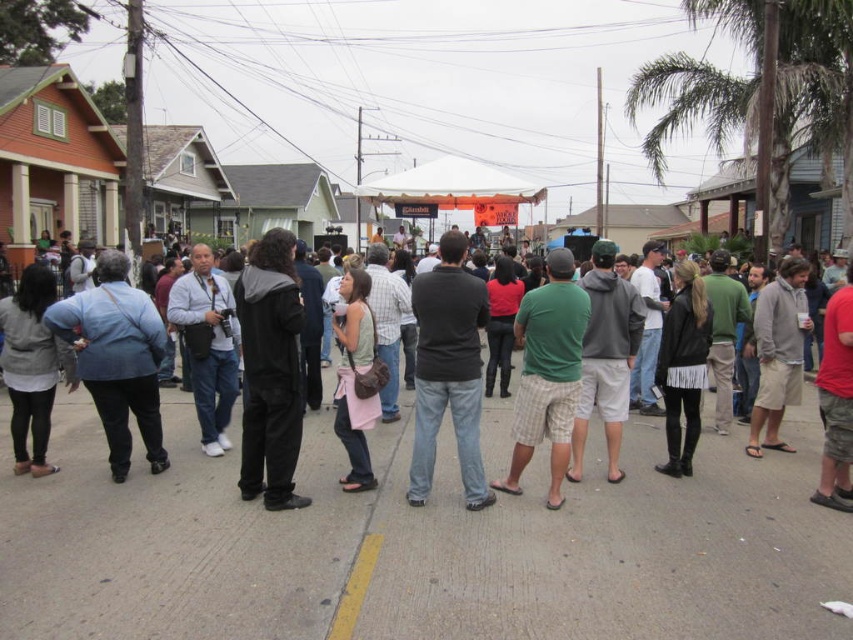
Between black matte jumpsuit at center and black matte shirt at center, which one appears on the right side from the viewer's perspective?

Positioned to the right is black matte shirt at center.

Consider the image. Who is lower down, black matte jumpsuit at center or black matte shirt at center?

black matte shirt at center is lower down.

What do you see at coordinates (270, 371) in the screenshot?
I see `black matte jumpsuit at center` at bounding box center [270, 371].

At what (x,y) coordinates should I click in order to perform the action: click on black matte jumpsuit at center. Please return your answer as a coordinate pair (x, y). The width and height of the screenshot is (853, 640). Looking at the image, I should click on tap(270, 371).

Between black leather jacket at center and black matte shirt at center, which one appears on the left side from the viewer's perspective?

black leather jacket at center

Who is more forward, (668, 429) or (434, 436)?

Point (434, 436) is more forward.

In order to click on black leather jacket at center in this screenshot , I will do `click(126, 426)`.

Is green plaid shorts at center positioned at the back of matte black jacket at left?

No, it is in front of matte black jacket at left.

Is point (526, 428) closer to camera compared to point (10, 403)?

Yes, point (526, 428) is closer to viewer.

What are the coordinates of `green plaid shorts at center` in the screenshot? It's located at (547, 372).